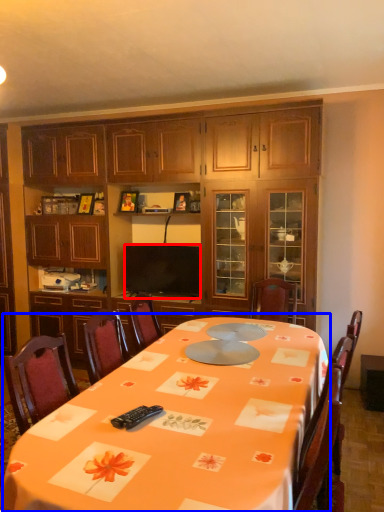
Question: Among these objects, which one is nearest to the camera, television (highlighted by a red box) or round table (highlighted by a blue box)?

Choices:
 (A) television
 (B) round table

Answer: (B)